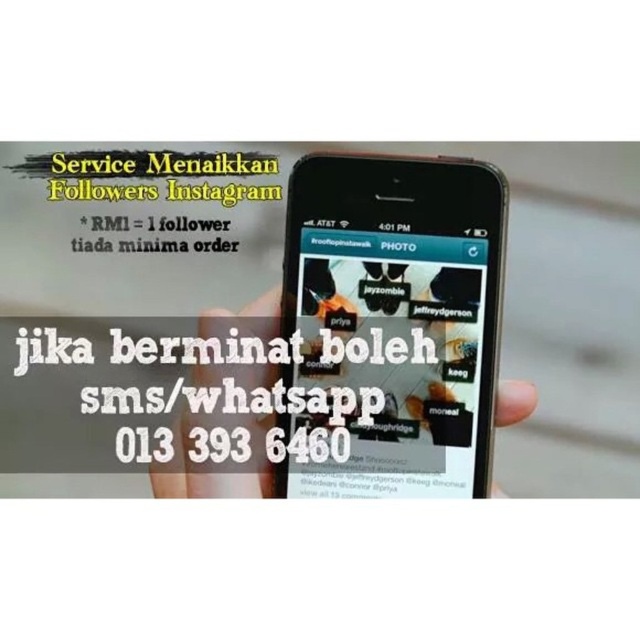
Which is more to the right, black matte phone at center or white paper at center?

Positioned to the right is black matte phone at center.

You are a GUI agent. You are given a task and a screenshot of the screen. Output one action in this format:
    pyautogui.click(x=<x>, y=<y>)
    Task: Click on the black matte phone at center
    
    Given the screenshot: What is the action you would take?
    pyautogui.click(x=392, y=324)